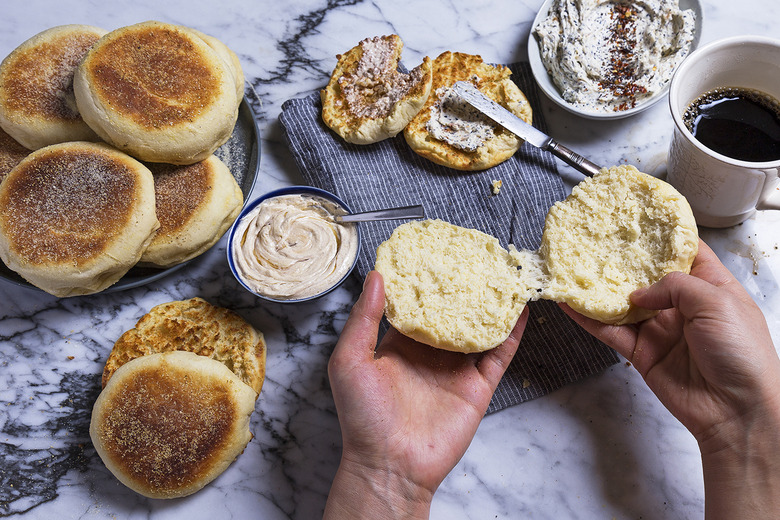
Identify the location of striped rag. (388, 183).